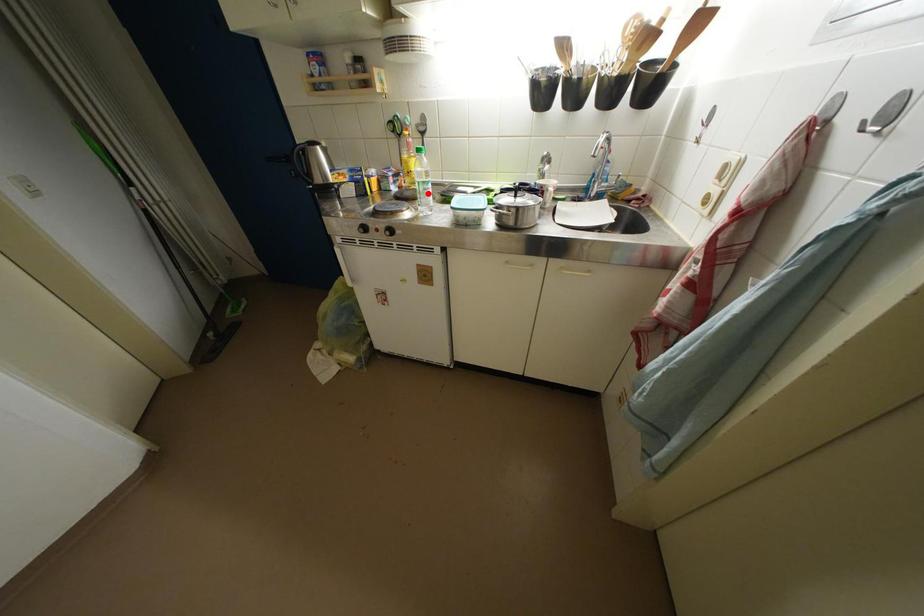
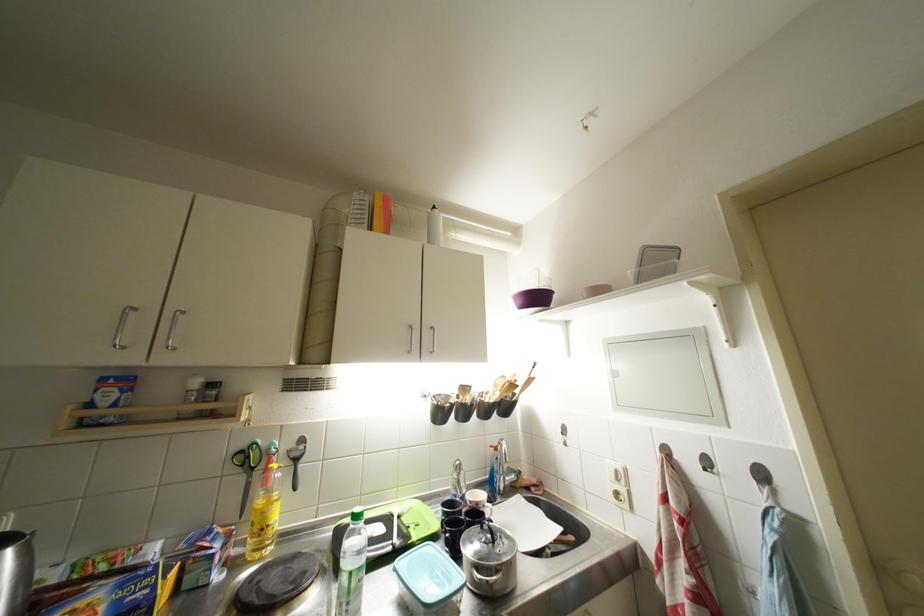
In the second image, find the point that corresponds to the highlighted location in the first image.

(359, 589)